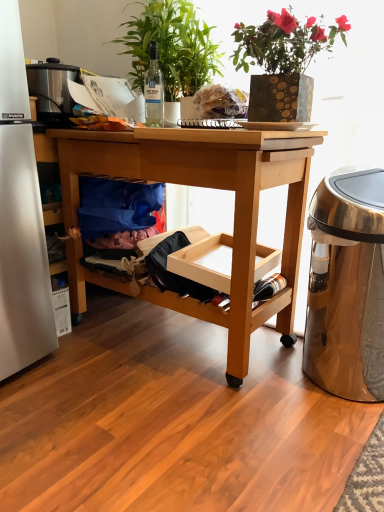
The height and width of the screenshot is (512, 384). Identify the location of free location in front of shiny metallic trash can at right. (326, 437).